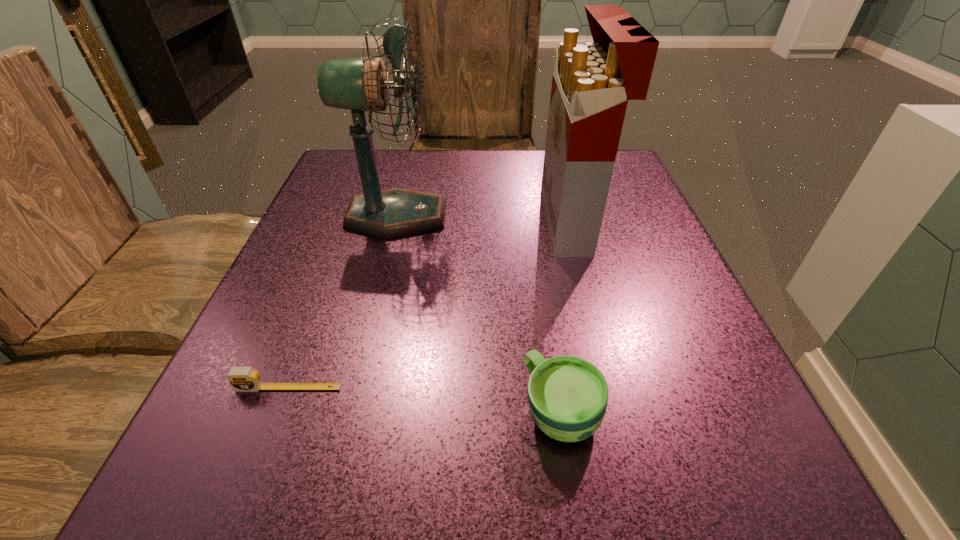
Locate an element on the screen. cigarette case that is at the far edge is located at coordinates (591, 85).

At what (x,y) coordinates should I click in order to perform the action: click on object situated at the near edge. Please return your answer as a coordinate pair (x, y). Looking at the image, I should click on (568, 396).

Find the location of a particular element. Image resolution: width=960 pixels, height=540 pixels. fan that is at the left edge is located at coordinates (359, 84).

Locate an element on the screen. tape measure at the left edge is located at coordinates (242, 379).

Locate an element on the screen. object that is positioned at the right edge is located at coordinates (591, 85).

Where is `object positioned at the far left corner`? object positioned at the far left corner is located at coordinates (359, 84).

Locate an element on the screen. object situated at the far right corner is located at coordinates (591, 85).

In the image, there is a desktop. At what (x,y) coordinates should I click in order to perform the action: click on vacant space at the far edge. Please return your answer as a coordinate pair (x, y). This screenshot has width=960, height=540. Looking at the image, I should click on (420, 176).

Locate an element on the screen. The width and height of the screenshot is (960, 540). vacant space at the near edge is located at coordinates (380, 443).

Where is `vacant space at the left edge of the desktop`? vacant space at the left edge of the desktop is located at coordinates (230, 408).